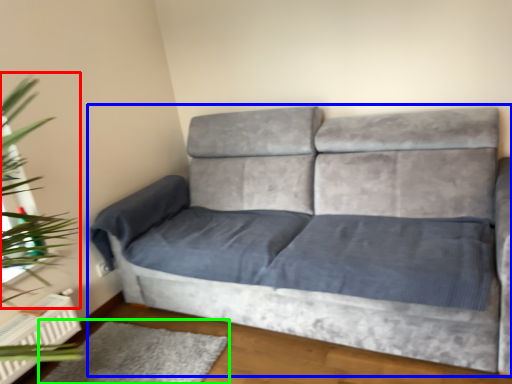
Question: Based on their relative distances, which object is nearer to plant (highlighted by a red box)? Choose from studio couch (highlighted by a blue box) and mat (highlighted by a green box).

Choices:
 (A) studio couch
 (B) mat

Answer: (B)